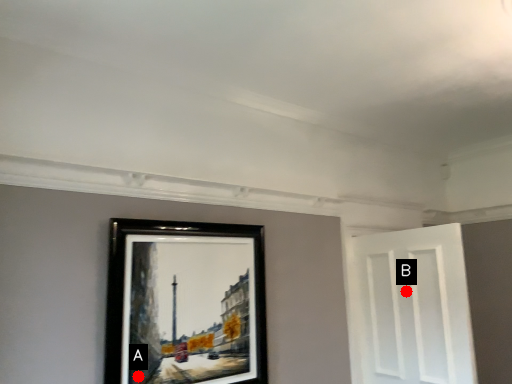
Question: Two points are circled on the image, labeled by A and B beside each circle. Which point appears farthest from the camera in this image?

Choices:
 (A) A is further
 (B) B is further

Answer: (B)